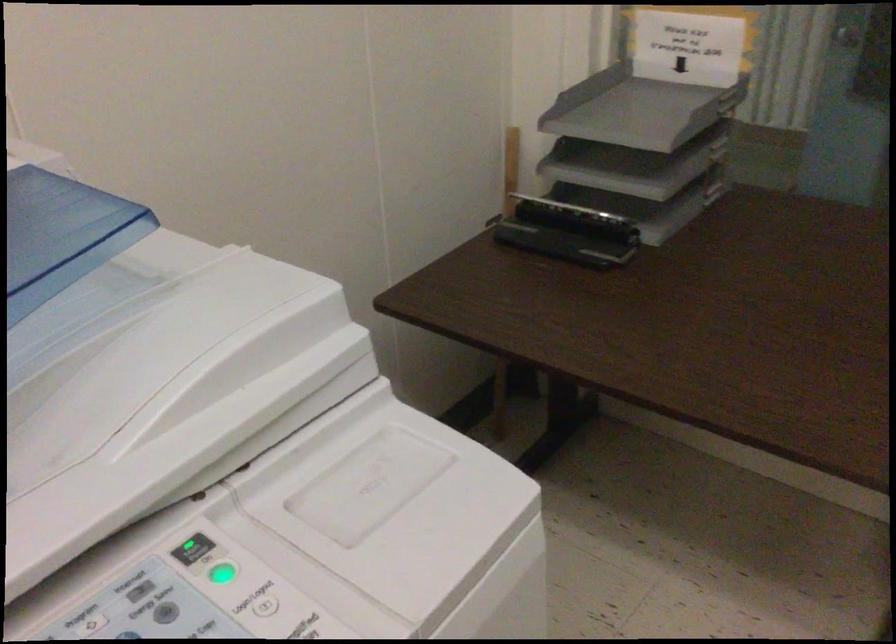
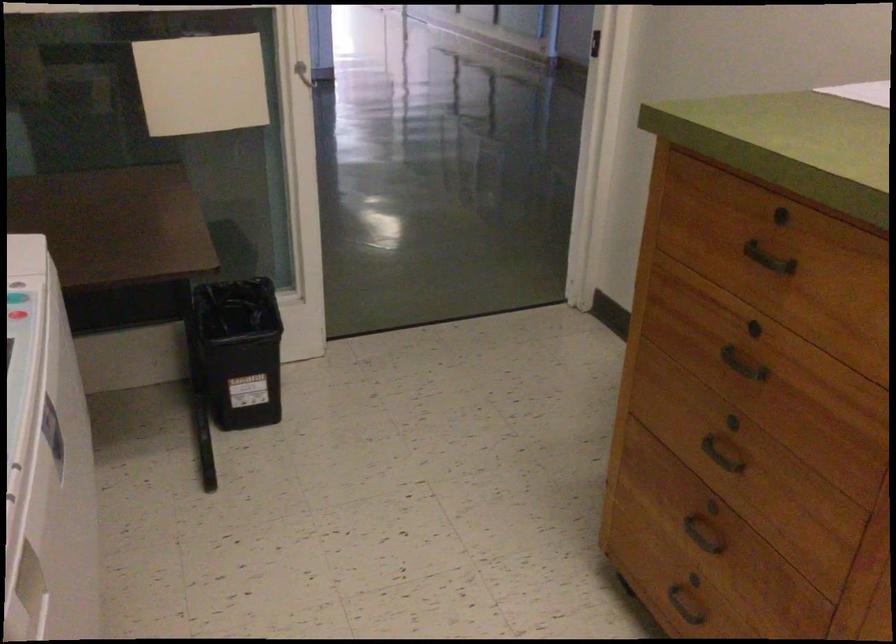
Question: The camera is either moving clockwise (left) or counter-clockwise (right) around the object. The first image is from the beginning of the video and the second image is from the end. Is the camera moving left or right when shooting the video?

Choices:
 (A) Left
 (B) Right

Answer: (A)